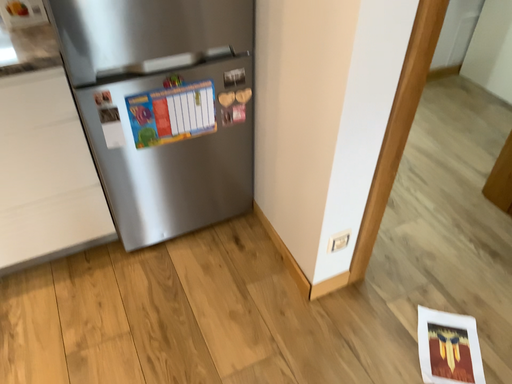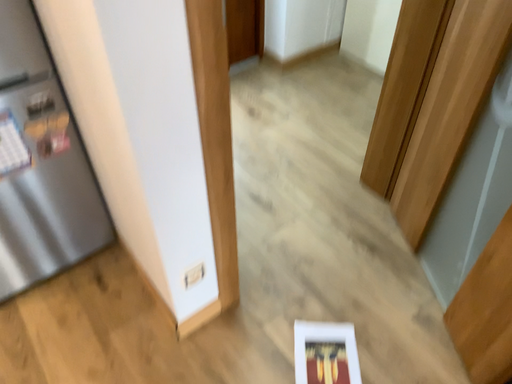
Question: Which way did the camera rotate in the video?

Choices:
 (A) rotated left
 (B) rotated right

Answer: (B)